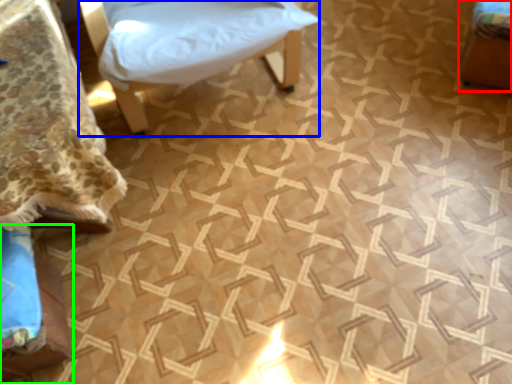
Question: Based on their relative distances, which object is farther from furniture (highlighted by a red box)? Choose from furniture (highlighted by a blue box) and furniture (highlighted by a green box).

Choices:
 (A) furniture
 (B) furniture

Answer: (B)